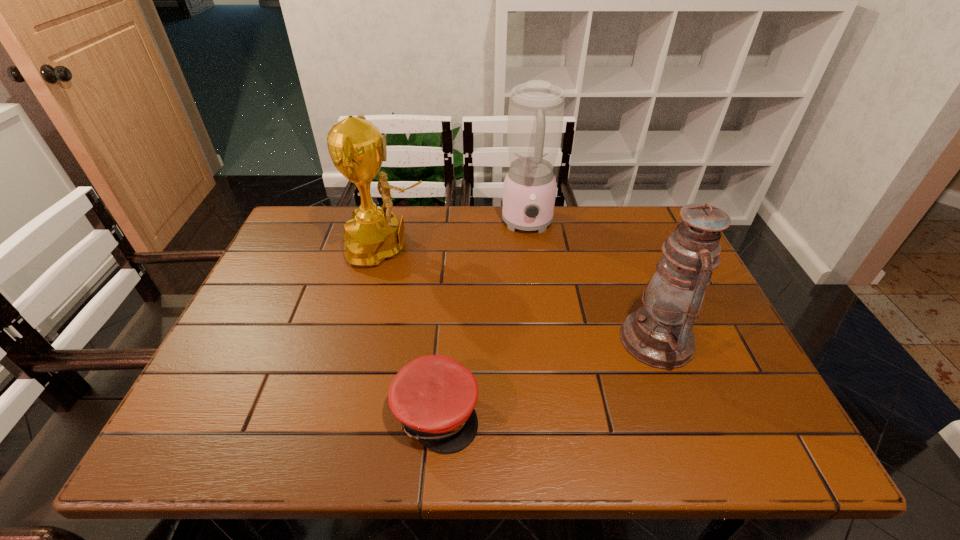
The width and height of the screenshot is (960, 540). In order to click on the third object from left to right in this screenshot , I will do `click(536, 108)`.

Image resolution: width=960 pixels, height=540 pixels. I want to click on award, so click(373, 234).

This screenshot has width=960, height=540. I want to click on oil lamp, so click(659, 334).

Where is `the shortest object`? The width and height of the screenshot is (960, 540). the shortest object is located at coordinates (434, 396).

Identify the location of vacant position located on the base of the food processor near the control knob. (534, 271).

At what (x,y) coordinates should I click in order to perform the action: click on free location located 0.160m on the front side of the award. Please return your answer as a coordinate pair (x, y). The width and height of the screenshot is (960, 540). Looking at the image, I should click on (486, 247).

At what (x,y) coordinates should I click in order to perform the action: click on free spot located 0.240m on the left of the oil lamp. Please return your answer as a coordinate pair (x, y). This screenshot has height=540, width=960. Looking at the image, I should click on [x=517, y=340].

In order to click on vacant point located 0.190m at the front of the cap where the visor is located in this screenshot , I will do `click(573, 413)`.

Where is `food processor that is positioned at the far edge`? food processor that is positioned at the far edge is located at coordinates (536, 108).

Where is `award present at the far edge`? Image resolution: width=960 pixels, height=540 pixels. award present at the far edge is located at coordinates (373, 234).